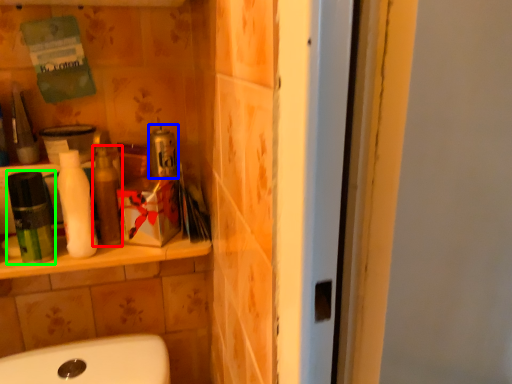
Question: Estimate the real-world distances between objects in this image. Which object is closer to toiletry (highlighted by a red box), product (highlighted by a blue box) or mouthwash (highlighted by a green box)?

Choices:
 (A) product
 (B) mouthwash

Answer: (A)